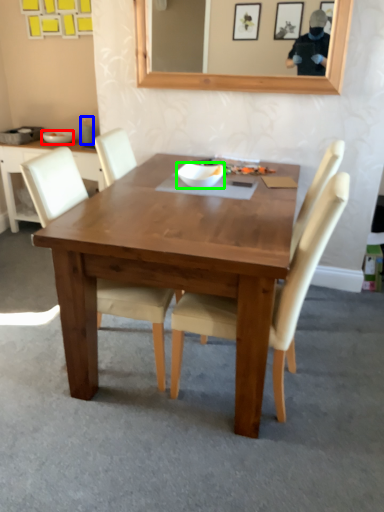
Question: Estimate the real-world distances between objects in this image. Which object is closer to bowl (highlighted by a red box), coffee cup (highlighted by a blue box) or bowl (highlighted by a green box)?

Choices:
 (A) coffee cup
 (B) bowl

Answer: (A)